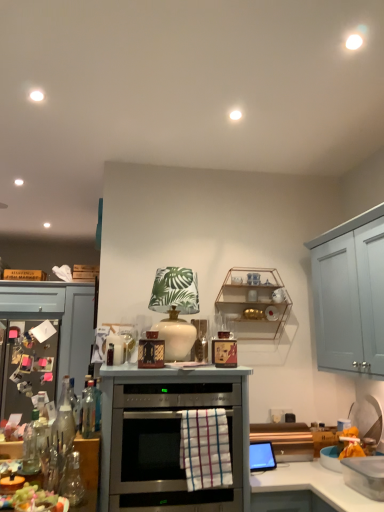
Question: Is satin silver oven at center smaller than clear plastic container at lower right, which appears as the second appliance when viewed from the top?

Choices:
 (A) yes
 (B) no

Answer: (B)

Question: Does satin silver oven at center have a lesser width compared to clear plastic container at lower right, marked as the first appliance in a front-to-back arrangement?

Choices:
 (A) no
 (B) yes

Answer: (A)

Question: Can you confirm if satin silver oven at center is shorter than clear plastic container at lower right, which appears as the second appliance when viewed from the top?

Choices:
 (A) no
 (B) yes

Answer: (A)

Question: From a real-world perspective, is satin silver oven at center below clear plastic container at lower right, positioned as the 2th appliance in left-to-right order?

Choices:
 (A) yes
 (B) no

Answer: (B)

Question: Are satin silver oven at center and clear plastic container at lower right, the 1th appliance when ordered from bottom to top, far apart?

Choices:
 (A) no
 (B) yes

Answer: (A)

Question: Considering their positions, is clear glass bottle at center, arranged as the second bottle when viewed from the left, located in front of or behind satin silver oven at center?

Choices:
 (A) behind
 (B) front

Answer: (A)

Question: From their relative heights in the image, would you say clear glass bottle at center, the first bottle when ordered from right to left, is taller or shorter than satin silver oven at center?

Choices:
 (A) tall
 (B) short

Answer: (B)

Question: Based on their positions, is clear glass bottle at center, arranged as the second bottle when viewed from the left, located to the left or right of satin silver oven at center?

Choices:
 (A) left
 (B) right

Answer: (A)

Question: From a real-world perspective, is clear glass bottle at center, arranged as the second bottle when viewed from the left, above or below satin silver oven at center?

Choices:
 (A) below
 (B) above

Answer: (B)

Question: Based on their positions, is satin silver oven at center located to the left or right of translucent glass grapes at lower left?

Choices:
 (A) right
 (B) left

Answer: (A)

Question: Choose the correct answer: Is satin silver oven at center inside translucent glass grapes at lower left or outside it?

Choices:
 (A) outside
 (B) inside

Answer: (A)

Question: Considering their positions, is satin silver oven at center located in front of or behind translucent glass grapes at lower left?

Choices:
 (A) behind
 (B) front

Answer: (A)

Question: From a real-world perspective, is satin silver oven at center positioned above or below translucent glass grapes at lower left?

Choices:
 (A) below
 (B) above

Answer: (B)

Question: Is clear glass bottle at center, the first bottle when ordered from right to left, bigger or smaller than white checkered towel at center?

Choices:
 (A) small
 (B) big

Answer: (A)

Question: Looking at their shapes, would you say clear glass bottle at center, arranged as the second bottle when viewed from the left, is wider or thinner than white checkered towel at center?

Choices:
 (A) wide
 (B) thin

Answer: (A)